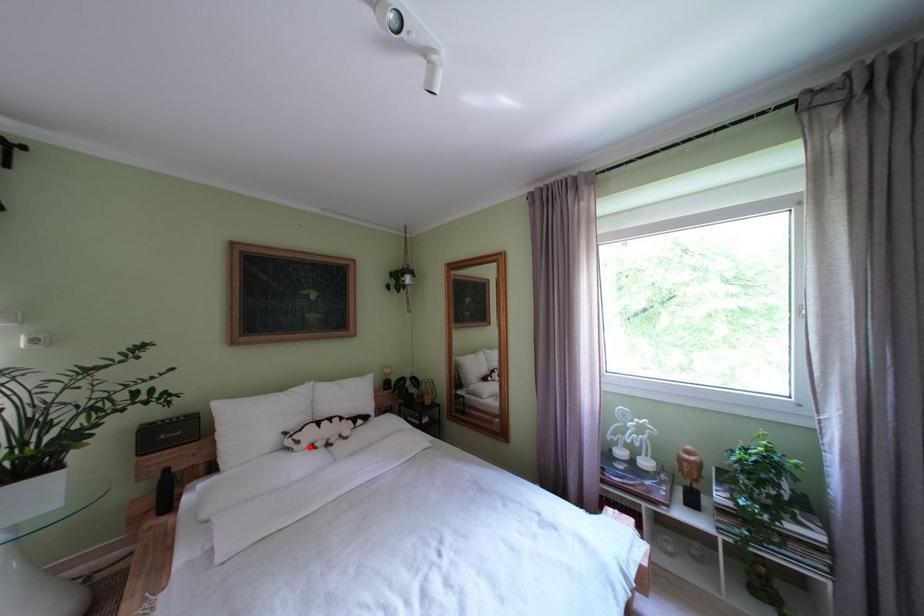
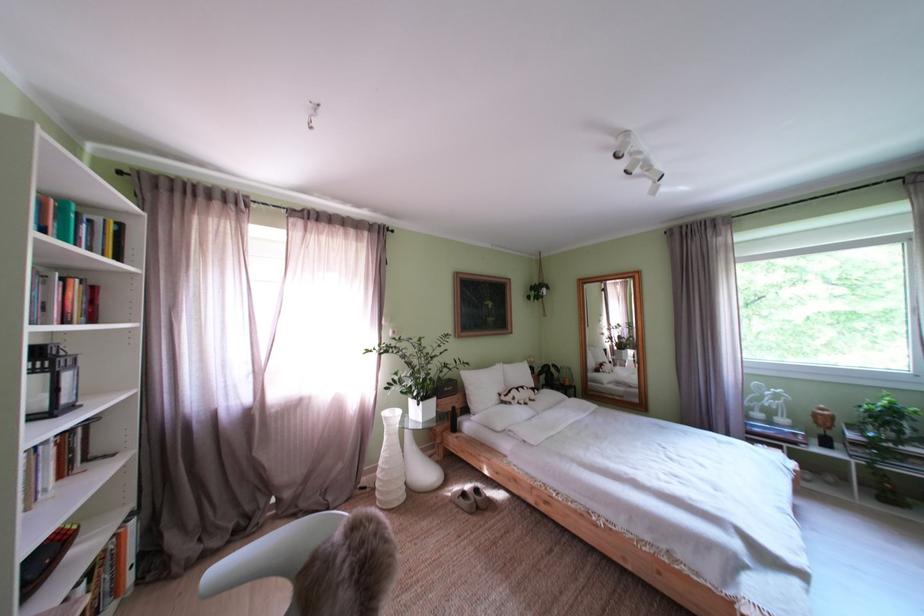
Locate, in the second image, the point that corresponds to the highlighted location in the first image.

(525, 405)